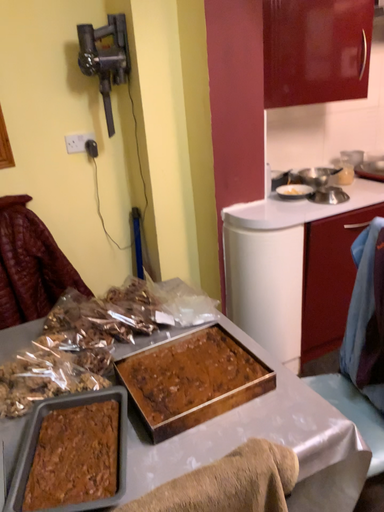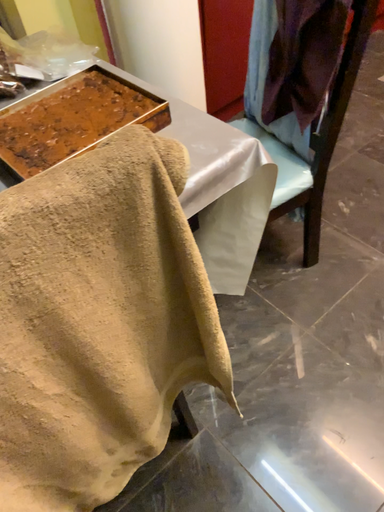
Question: How did the camera likely rotate when shooting the video?

Choices:
 (A) rotated downward
 (B) rotated upward

Answer: (A)